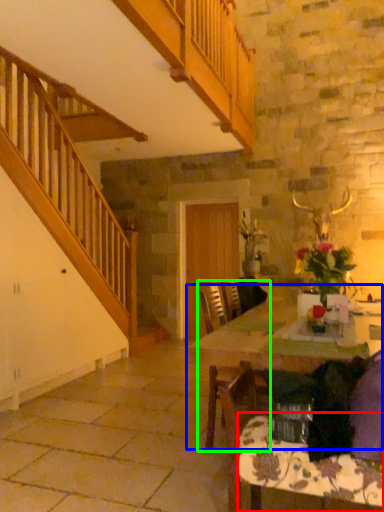
Question: Which is farther away from tablecloth (highlighted by a red box)? table (highlighted by a blue box) or chair (highlighted by a green box)?

Choices:
 (A) table
 (B) chair

Answer: (A)